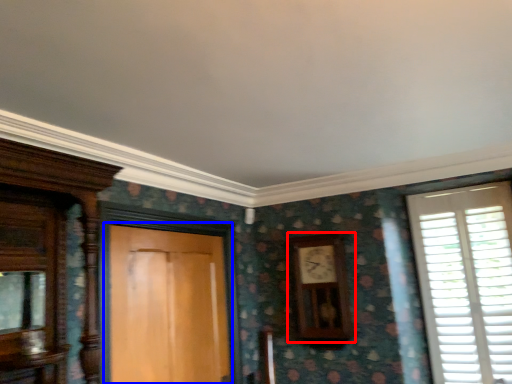
Question: Among these objects, which one is nearest to the camera, clock (highlighted by a red box) or door (highlighted by a blue box)?

Choices:
 (A) clock
 (B) door

Answer: (B)